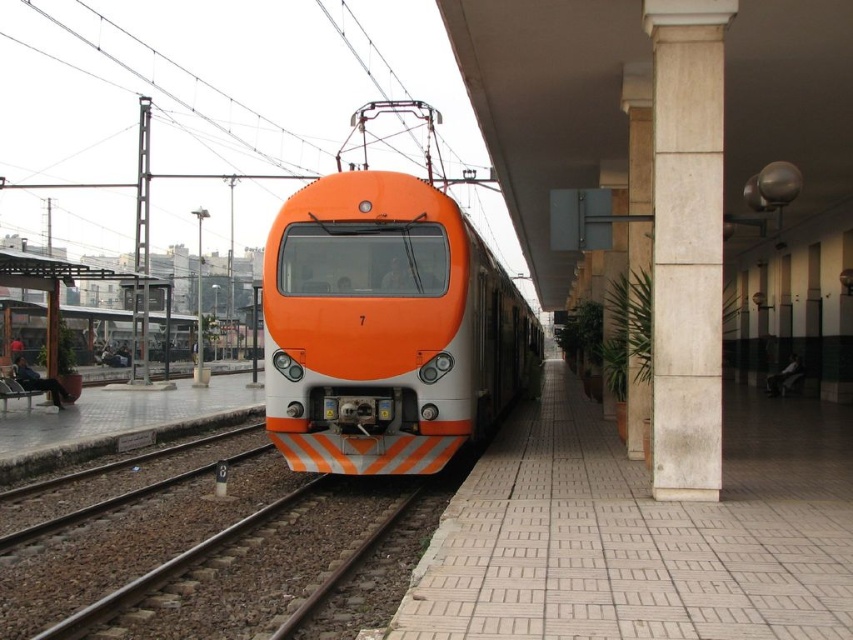
Question: Which point is farther to the camera?

Choices:
 (A) white marble column at right
 (B) orange glossy train at center
 (C) white tile platform at center
 (D) brown gravel train track at lower left

Answer: (B)

Question: Can you confirm if orange glossy train at center is positioned below brown gravel train track at lower left?

Choices:
 (A) no
 (B) yes

Answer: (A)

Question: Which is nearer to the orange glossy train at center?

Choices:
 (A) brown gravel train track at lower left
 (B) white tile platform at center
 (C) white marble column at right

Answer: (B)

Question: Does white tile platform at center lie behind brown gravel train track at lower left?

Choices:
 (A) no
 (B) yes

Answer: (A)

Question: Which object appears farthest from the camera in this image?

Choices:
 (A) white tile platform at center
 (B) brown gravel train track at lower left

Answer: (B)

Question: Can you confirm if white tile platform at center is positioned below white marble column at right?

Choices:
 (A) yes
 (B) no

Answer: (A)